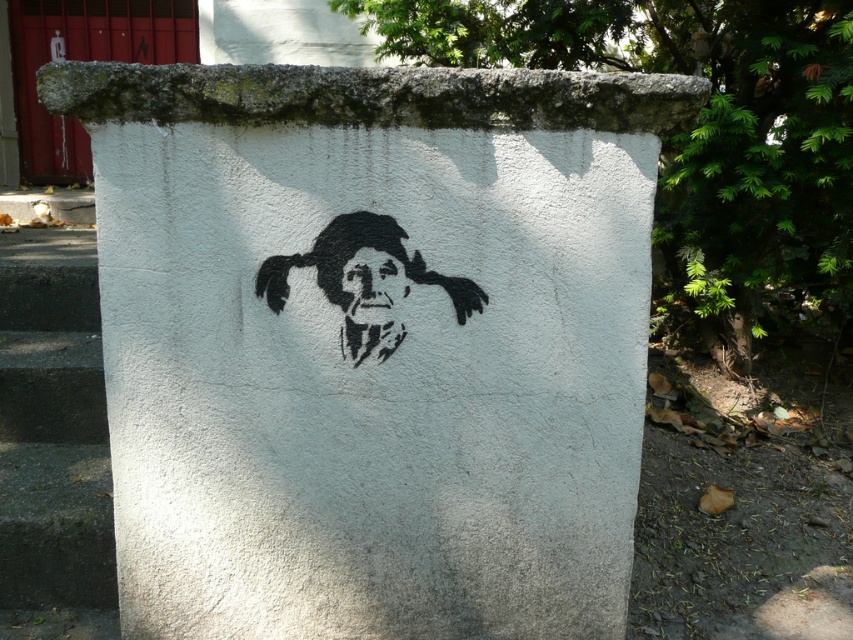
You are a painter who wants to add a new layer of paint over the black spray paint at center. The spray can you have can only spray in a radius of 6 inches. Can you reach the white concrete wall at center without moving the spray can?

The distance between the white concrete wall at center and the black spray paint at center is 7.27 inches. Since the spray can can only spray up to 6 inches, you cannot reach the white concrete wall at center without moving the spray can.

You are an artist planning to add a new design next to the existing black spray paint at center and black stencil face at center on the concrete wall. Given that the two artworks are 1.34 inches apart, will there be enough space to fit a third artwork that requires 1.5 inches of spacing between it and the existing ones?

The black spray paint at center and black stencil face at center are 1.34 inches apart, which is less than the required 1.5 inches spacing. Therefore, there isn not enough space to fit a third artwork with the required spacing between it and the existing ones.